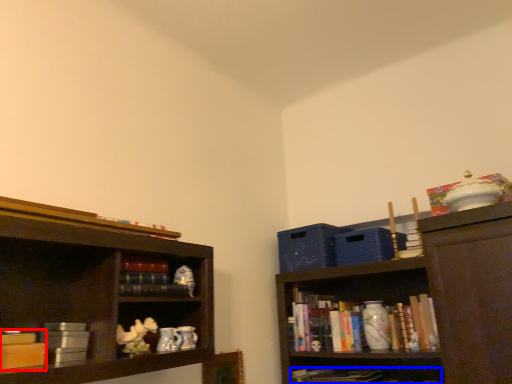
Question: Which object is closer to the camera taking this photo, book (highlighted by a red box) or book (highlighted by a blue box)?

Choices:
 (A) book
 (B) book

Answer: (A)